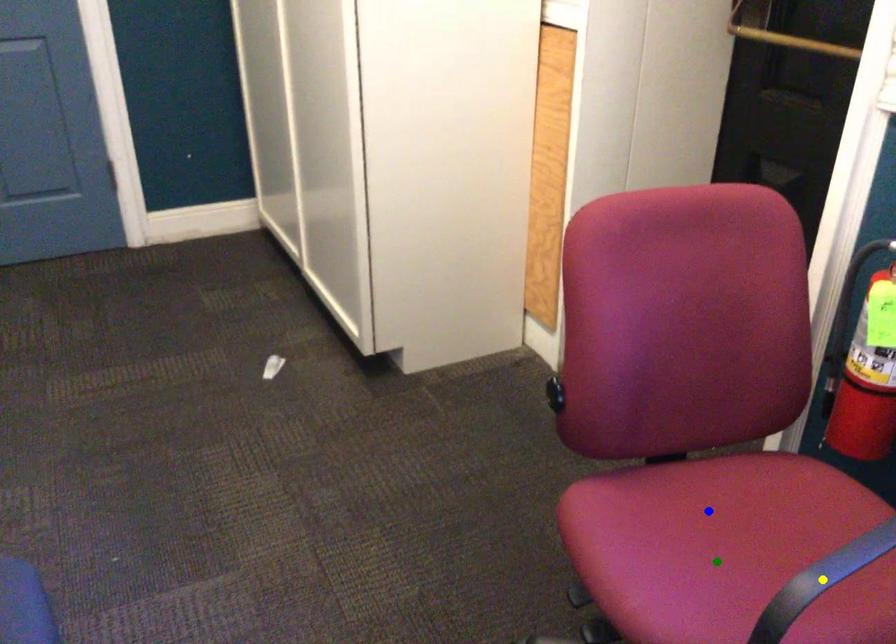
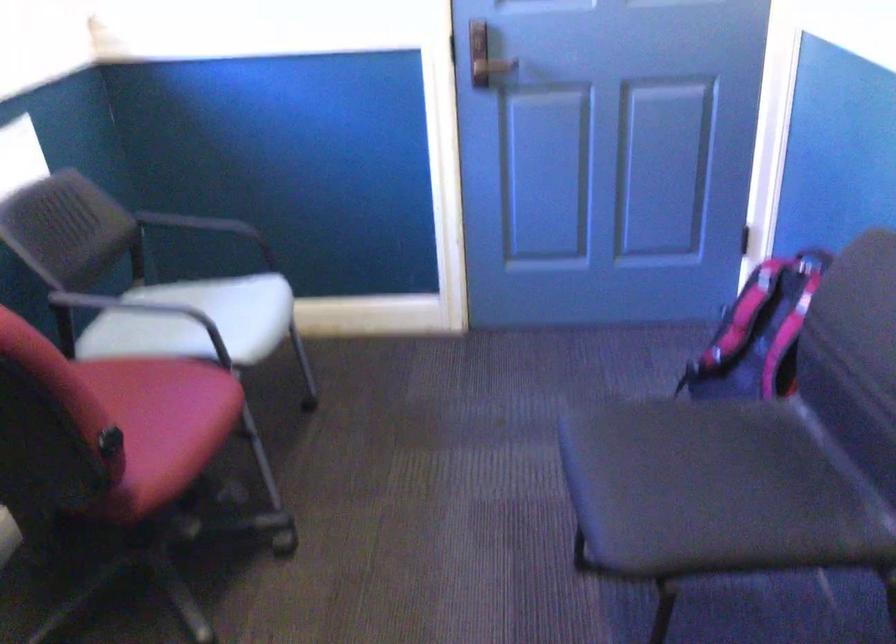
I am providing you with two images of the same scene from different viewpoints. Three points are marked in image1. Which point corresponds to a part or object that is occluded in image2?In image1, three points are marked. Which of them correspond to a part or object that is occluded in image2?Among the three points shown in image1, which one corresponds to a part or object that is no longer visible due to occlusion in image2?

blue point, yellow point cannot be seen in image2.